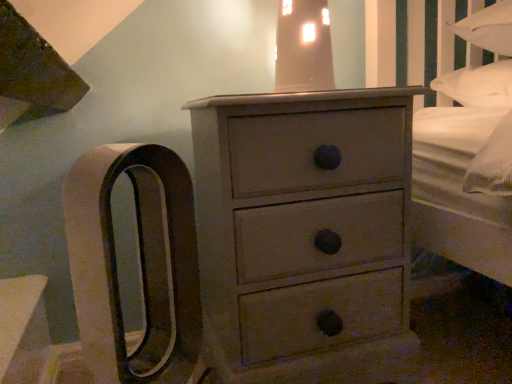
Question: Is matte gray chest of drawers at center smaller than matte glass lampshade at upper center?

Choices:
 (A) no
 (B) yes

Answer: (A)

Question: Can you confirm if matte gray chest of drawers at center is shorter than matte glass lampshade at upper center?

Choices:
 (A) no
 (B) yes

Answer: (A)

Question: From the image's perspective, is matte gray chest of drawers at center on top of matte glass lampshade at upper center?

Choices:
 (A) no
 (B) yes

Answer: (A)

Question: Considering the relative positions of matte gray chest of drawers at center and matte glass lampshade at upper center in the image provided, is matte gray chest of drawers at center to the left of matte glass lampshade at upper center from the viewer's perspective?

Choices:
 (A) yes
 (B) no

Answer: (A)

Question: Would you say matte gray chest of drawers at center is outside matte glass lampshade at upper center?

Choices:
 (A) no
 (B) yes

Answer: (B)

Question: Would you say matte gray chest of drawers at center contains matte glass lampshade at upper center?

Choices:
 (A) no
 (B) yes

Answer: (A)

Question: Is matte glass lampshade at upper center wider than matte gray chest of drawers at center?

Choices:
 (A) yes
 (B) no

Answer: (B)

Question: From the image's perspective, is matte glass lampshade at upper center on top of matte gray chest of drawers at center?

Choices:
 (A) no
 (B) yes

Answer: (B)

Question: Is matte glass lampshade at upper center aimed at matte gray chest of drawers at center?

Choices:
 (A) yes
 (B) no

Answer: (B)

Question: Is the depth of matte glass lampshade at upper center greater than that of matte gray chest of drawers at center?

Choices:
 (A) yes
 (B) no

Answer: (A)

Question: Considering the relative sizes of matte glass lampshade at upper center and matte gray chest of drawers at center in the image provided, is matte glass lampshade at upper center shorter than matte gray chest of drawers at center?

Choices:
 (A) no
 (B) yes

Answer: (B)

Question: Would you say matte glass lampshade at upper center contains matte gray chest of drawers at center?

Choices:
 (A) no
 (B) yes

Answer: (A)

Question: Looking at their shapes, would you say matte gray chest of drawers at center is wider or thinner than matte glass lampshade at upper center?

Choices:
 (A) thin
 (B) wide

Answer: (B)